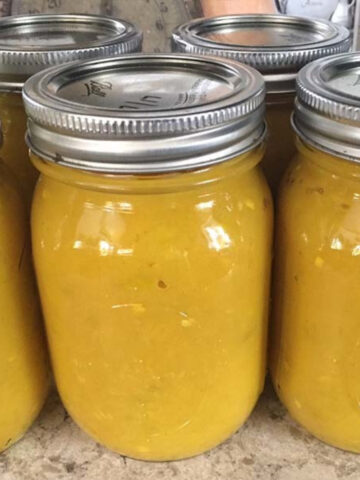
This screenshot has width=360, height=480. What are the coordinates of `counter top` in the screenshot? It's located at [x=266, y=431].